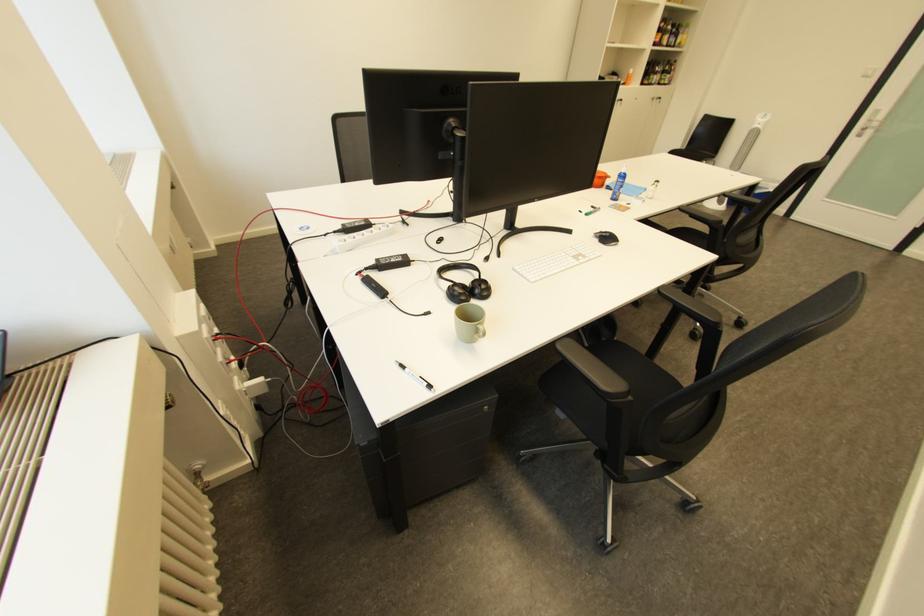
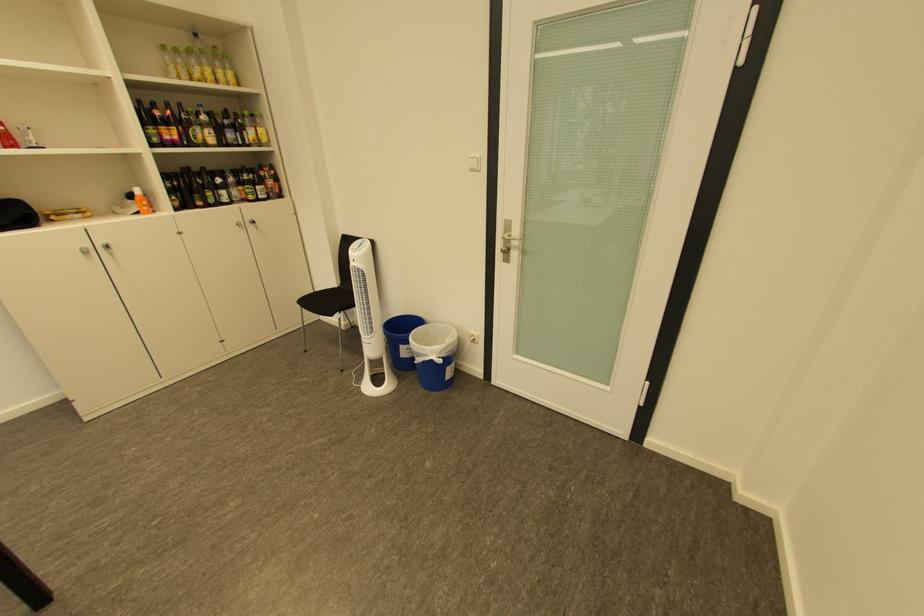
Locate, in the second image, the point that corresponds to the point at 770,188 in the first image.

(429, 355)